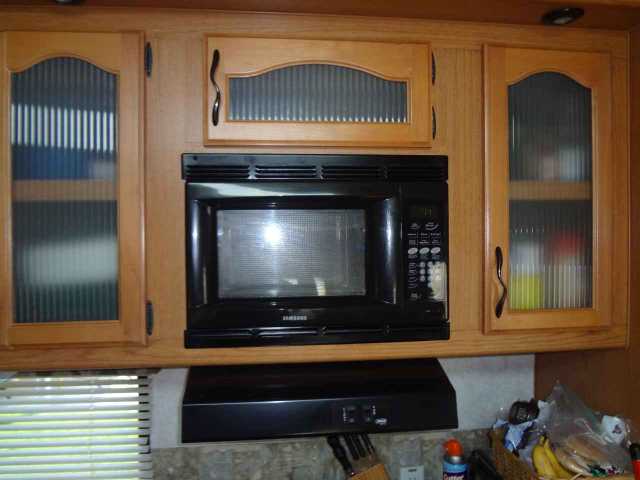
Locate an element on the screen. 1 black microwave is located at coordinates (198, 193).